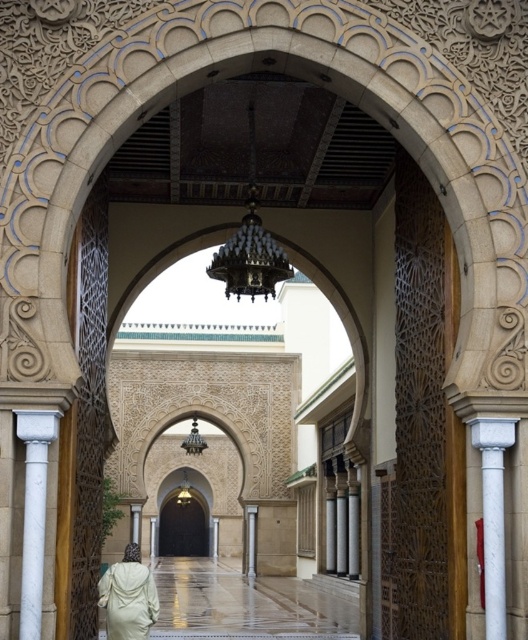
Question: Which object is farther from the camera taking this photo?

Choices:
 (A) white marble column at center
 (B) light beige fabric dress at lower left
 (C) white marble column at right

Answer: (A)

Question: Is white marble column at left thinner than white marble column at right?

Choices:
 (A) yes
 (B) no

Answer: (A)

Question: Can you confirm if white marble column at right is positioned above light beige fabric dress at lower left?

Choices:
 (A) no
 (B) yes

Answer: (B)

Question: Does white marble column at left appear under light beige fabric dress at lower left?

Choices:
 (A) yes
 (B) no

Answer: (B)

Question: Which object is positioned farthest from the white marble column at left?

Choices:
 (A) light beige fabric dress at lower left
 (B) white marble column at center

Answer: (B)

Question: Which of the following is the farthest from the observer?

Choices:
 (A) light beige fabric dress at lower left
 (B) white marble column at right
 (C) white marble column at center
 (D) white marble column at left

Answer: (C)